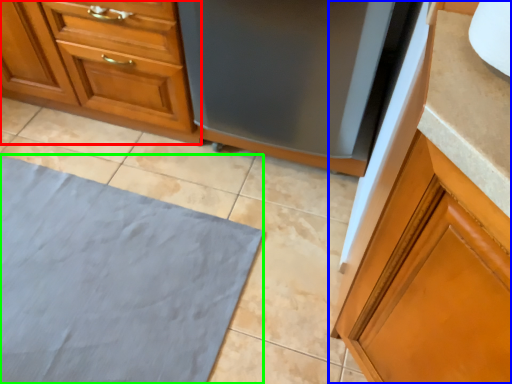
Question: Which object is the farthest from cabinetry (highlighted by a red box)? Choose among these: cabinetry (highlighted by a blue box) or bath mat (highlighted by a green box).

Choices:
 (A) cabinetry
 (B) bath mat

Answer: (A)